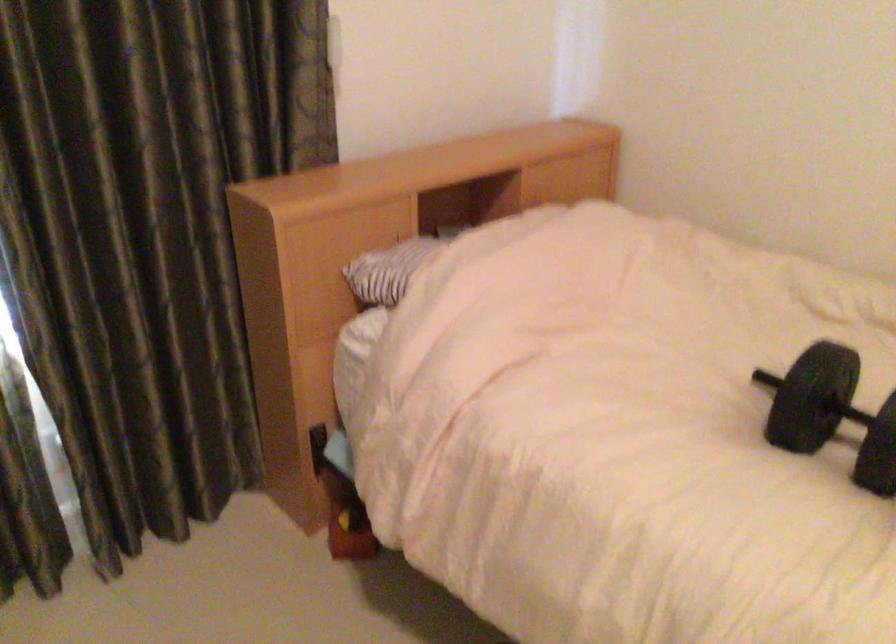
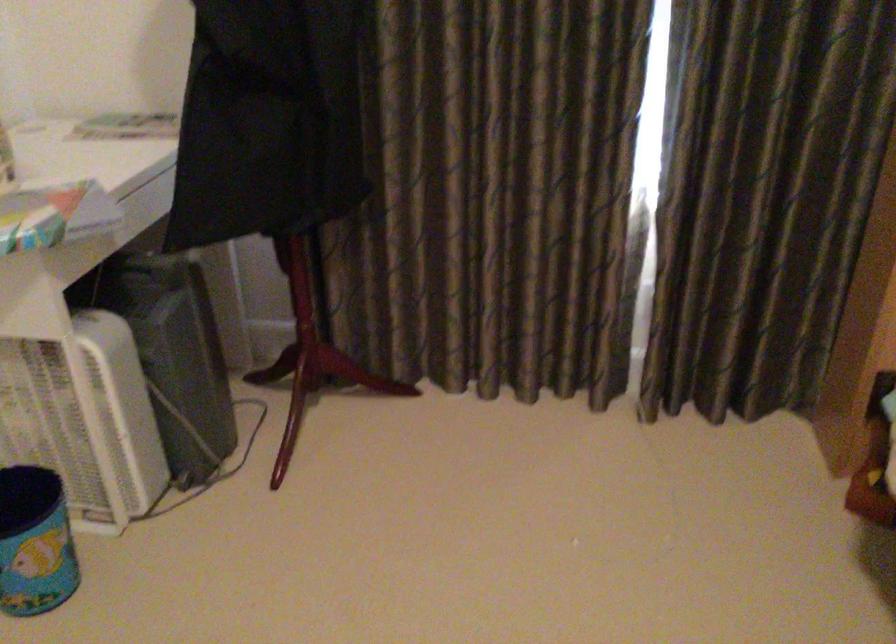
Locate, in the second image, the point that corresponds to the point at 268,374 in the first image.

(865, 298)